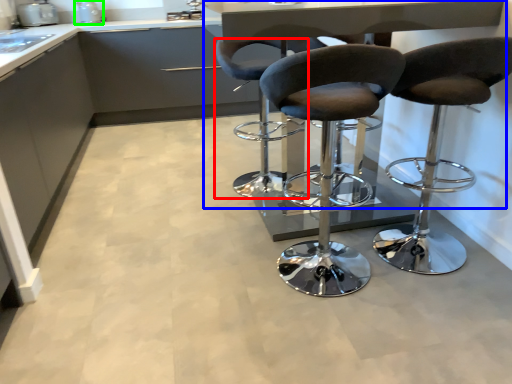
Question: Which object is the closest to the chair (highlighted by a red box)? Choose among these: table (highlighted by a blue box) or appliance (highlighted by a green box).

Choices:
 (A) table
 (B) appliance

Answer: (A)